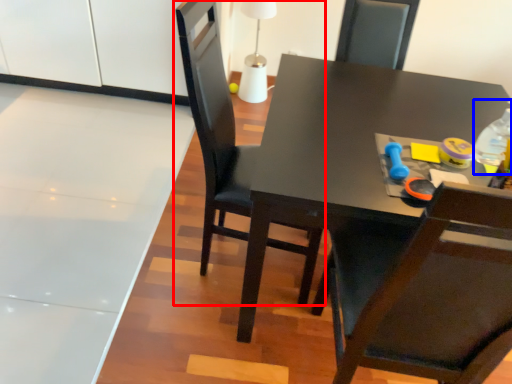
Question: Which object appears farthest to the camera in this image, chair (highlighted by a red box) or bottle (highlighted by a blue box)?

Choices:
 (A) chair
 (B) bottle

Answer: (B)